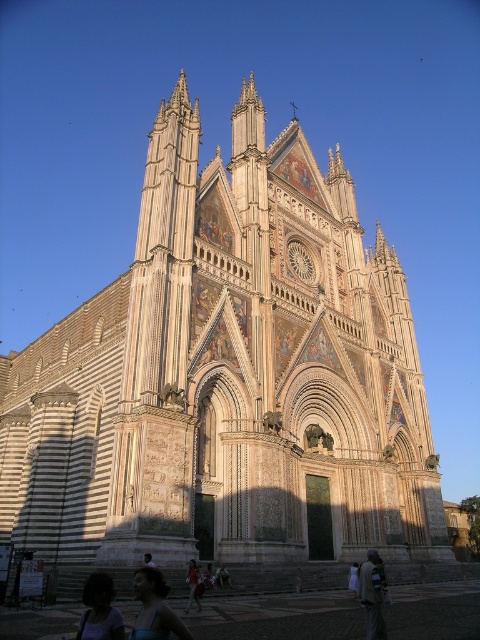
Question: Observing the image, what is the correct spatial positioning of blue fabric person at lower left in reference to light brown fabric dress at lower center?

Choices:
 (A) right
 (B) left

Answer: (B)

Question: Which object appears closest to the camera in this image?

Choices:
 (A) matte black hair at lower center
 (B) light brown fabric dress at lower center
 (C) dark gray fabric at lower right
 (D) blue fabric person at lower left

Answer: (D)

Question: Does light brown leather jacket at lower center have a lesser width compared to light brown fabric dress at lower center?

Choices:
 (A) no
 (B) yes

Answer: (B)

Question: Which of these objects is positioned farthest from the blue fabric person at lower left?

Choices:
 (A) matte black hair at lower center
 (B) light brown leather jacket at lower center

Answer: (B)

Question: Is matte black hair at lower center bigger than dark gray fabric at lower right?

Choices:
 (A) yes
 (B) no

Answer: (B)

Question: Which point is closer to the camera?

Choices:
 (A) dark gray fabric at lower right
 (B) light brown hair at lower center
 (C) matte black hair at lower center
 (D) light brown leather jacket at lower center

Answer: (C)